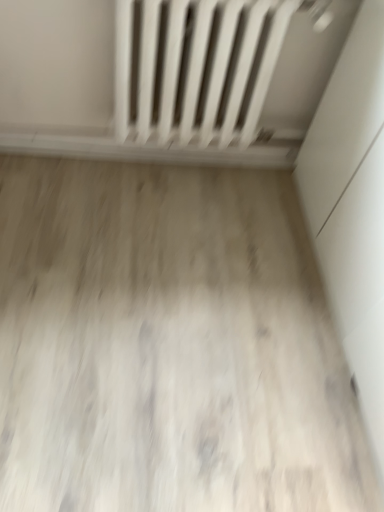
I want to click on vacant area on top of wooden floor at center (from a real-world perspective), so click(x=160, y=291).